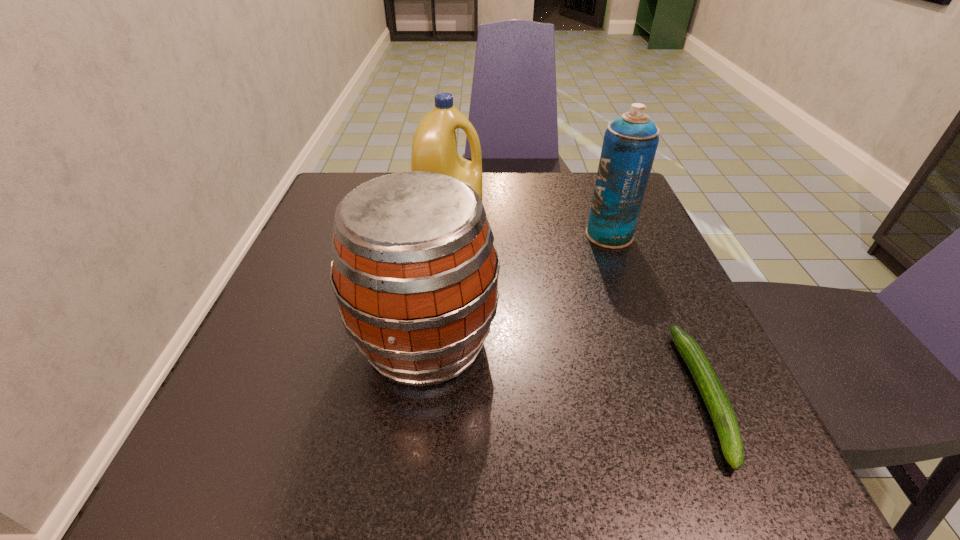
Identify the location of detergent. [434, 148].

This screenshot has height=540, width=960. What are the coordinates of `aerosol can` in the screenshot? It's located at (630, 142).

Locate an element on the screen. Image resolution: width=960 pixels, height=540 pixels. cider is located at coordinates (415, 272).

You are a GUI agent. You are given a task and a screenshot of the screen. Output one action in this format:
    pyautogui.click(x=<x>, y=<y>)
    Task: Click on the zucchini
    
    Given the screenshot: What is the action you would take?
    pyautogui.click(x=712, y=392)

The width and height of the screenshot is (960, 540). I want to click on vacant space located on the label of the detergent, so click(645, 222).

I want to click on vacant area situated on the back of the aerosol can, so click(x=593, y=194).

The image size is (960, 540). I want to click on vacant space located 0.070m on the right of the cider, so click(540, 341).

Image resolution: width=960 pixels, height=540 pixels. Identify the location of detergent at the far edge. (434, 148).

In order to click on aerosol can that is at the far edge in this screenshot , I will do `click(630, 142)`.

Where is `object that is at the near edge`? The height and width of the screenshot is (540, 960). object that is at the near edge is located at coordinates (712, 392).